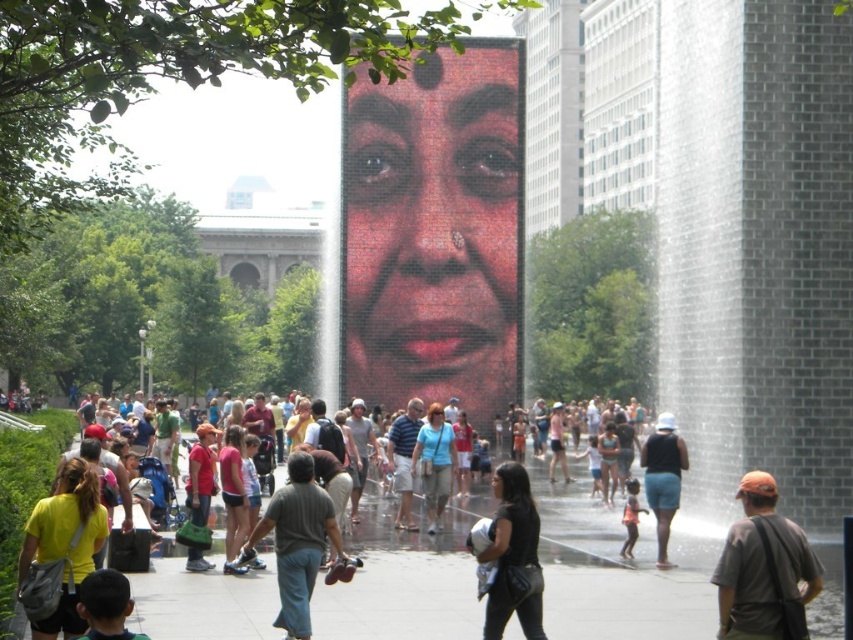
Can you confirm if matte black tank top at center is thinner than matte blue shirt at center?

Correct, matte black tank top at center's width is less than matte blue shirt at center's.

Does matte black tank top at center have a greater height compared to matte blue shirt at center?

Correct, matte black tank top at center is much taller as matte blue shirt at center.

Where is `matte black tank top at center`? This screenshot has width=853, height=640. matte black tank top at center is located at coordinates (663, 477).

Who is taller, yellow fabric shirt at lower left or matte blue shirt at center?

matte blue shirt at center

Does yellow fabric shirt at lower left appear on the left side of matte blue shirt at center?

Yes, yellow fabric shirt at lower left is to the left of matte blue shirt at center.

Find the location of a particular element. yellow fabric shirt at lower left is located at coordinates (61, 550).

Is matte red face at center further to camera compared to matte black face at center?

Yes, it is.

Is matte red face at center taller than matte black face at center?

Indeed, matte red face at center has a greater height compared to matte black face at center.

Locate an element on the screen. This screenshot has width=853, height=640. matte red face at center is located at coordinates (434, 230).

Find the location of a particular element. The image size is (853, 640). matte red face at center is located at coordinates (434, 230).